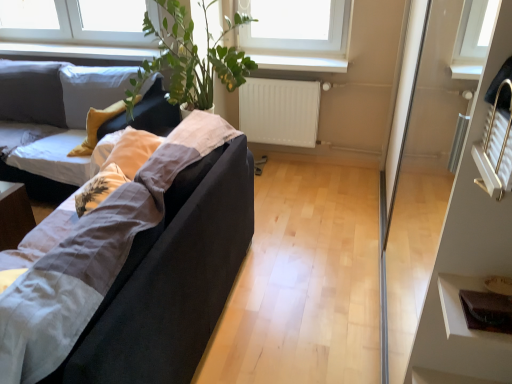
Question: From a real-world perspective, is brown leather wallet at lower right above or below white plastic window sill at upper center?

Choices:
 (A) below
 (B) above

Answer: (B)

Question: From the image's perspective, is brown leather wallet at lower right located above or below white plastic window sill at upper center?

Choices:
 (A) above
 (B) below

Answer: (B)

Question: Which object is positioned farthest from the matte black couch at left, which ranks as the second studio couch in back-to-front order?

Choices:
 (A) matte black couch at left, the 2th studio couch when ordered from front to back
 (B) white plastic window sill at upper center
 (C) white matte radiator at center
 (D) transparent glass door at right
 (E) brown leather wallet at lower right

Answer: (A)

Question: Estimate the real-world distances between objects in this image. Which object is closer to the matte black couch at left, which ranks as the second studio couch in back-to-front order?

Choices:
 (A) transparent glass door at right
 (B) brown leather wallet at lower right
 (C) white plastic window sill at upper center
 (D) matte black couch at left, marked as the first studio couch in a back-to-front arrangement
 (E) white matte radiator at center

Answer: (B)